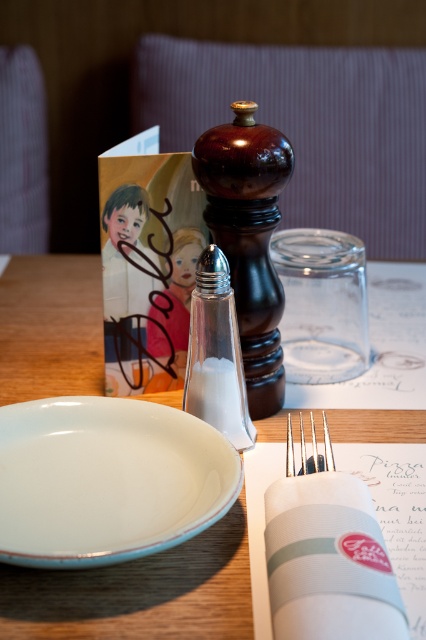
You are a waiter holding a tray that is 18 inches wide. You need to place it on the table without moving any existing items. Is there enough space between the point at coordinates [108,400] and the edge of the table to fit the tray?

The distance between the point at coordinates [108,400] and the camera is 20.51 inches. Since the tray is 18 inches wide, there is enough space to place it there as the distance is greater than the tray width.

Looking at this image, you are a server at a restaurant and need to place a new menu on the table. The menu is 12 inches long. The white glossy platter at lower left and the satin silver fork at center are already on the table. Can you fit the menu horizontally between them without moving any existing items?

The white glossy platter at lower left is positioned under the satin silver fork at center, meaning there is no horizontal space between them. Therefore, the 12 inch menu cannot be placed horizontally between them without moving existing items.